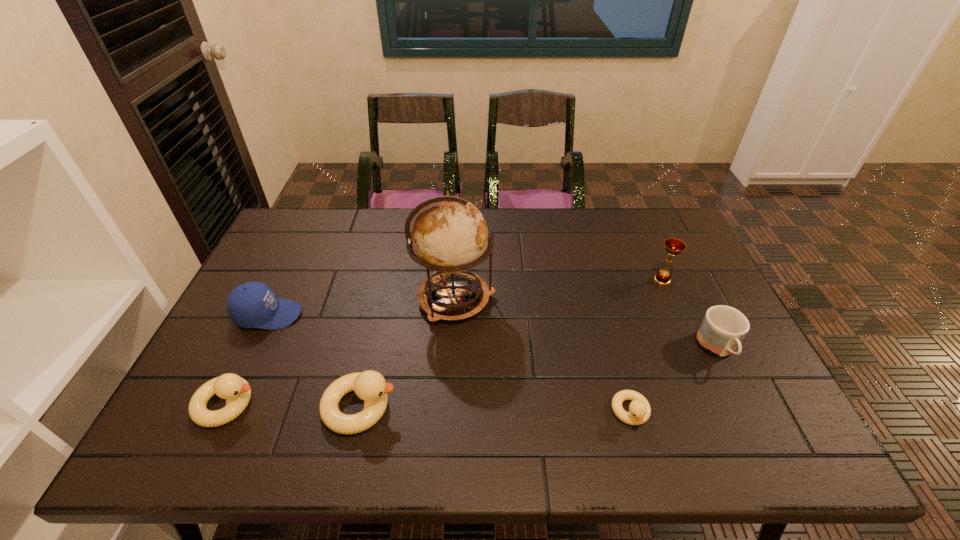
Identify the location of free space in the image that satisfies the following two spatial constraints: 1. on the side with the handle of the mug; 2. at the beak of the second duckling from left to right. The height and width of the screenshot is (540, 960). (746, 407).

This screenshot has height=540, width=960. In order to click on vacant region that satisfies the following two spatial constraints: 1. on the front side of the chalice; 2. at the center of the tallest object in this screenshot , I will do `click(670, 299)`.